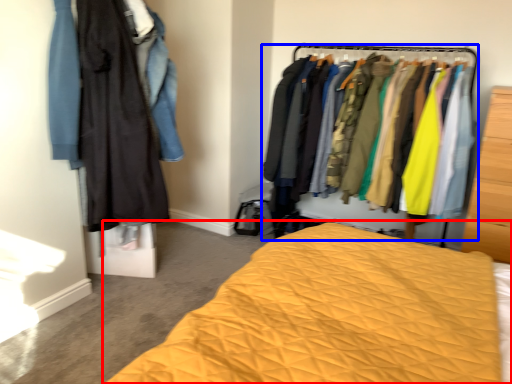
Question: Which point is closer to the camera, bed (highlighted by a red box) or closet (highlighted by a blue box)?

Choices:
 (A) bed
 (B) closet

Answer: (A)